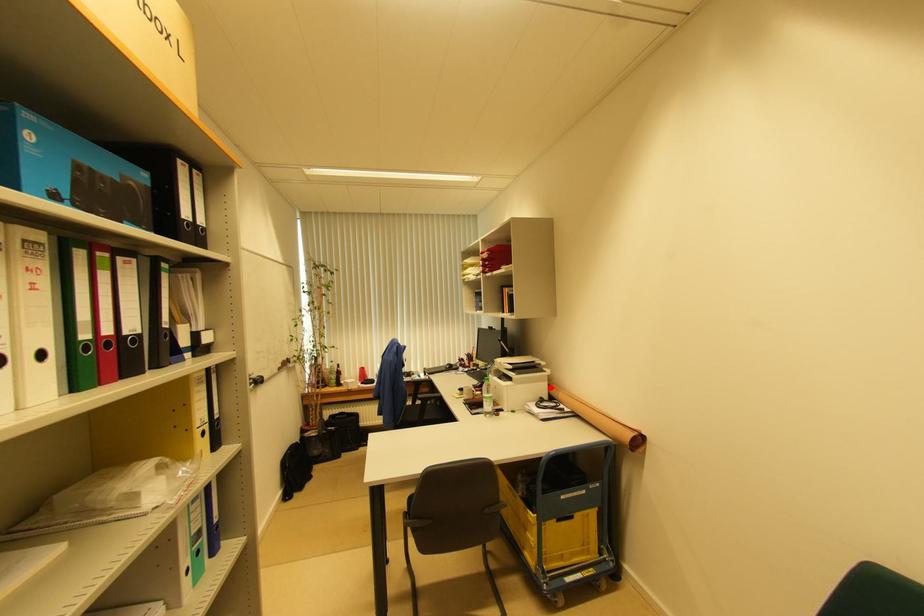
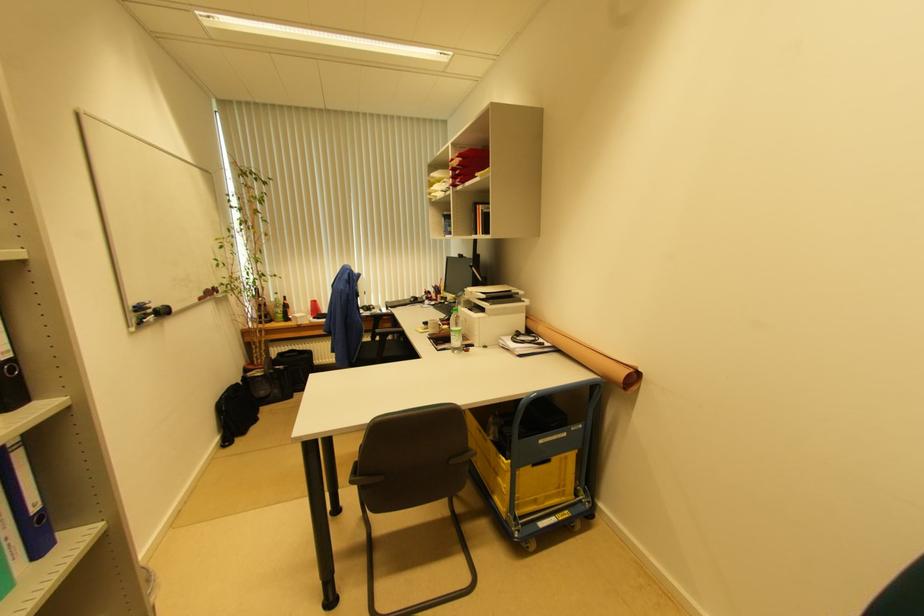
Question: I am providing you with two images of the same scene from different viewpoints. Given a red point in image1, look at the same physical point in image2. Is it:

Choices:
 (A) Closer to the viewpoint
 (B) Farther from the viewpoint

Answer: (A)